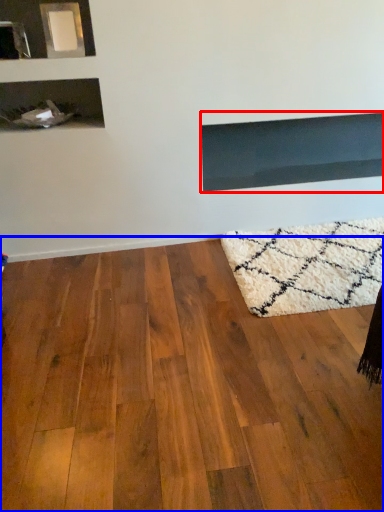
Question: Among these objects, which one is nearest to the camera, fireplace (highlighted by a red box) or hardwood (highlighted by a blue box)?

Choices:
 (A) fireplace
 (B) hardwood

Answer: (B)